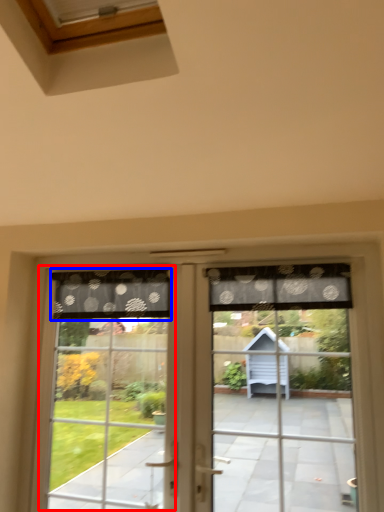
Question: Which of the following is the closest to the observer, bay window (highlighted by a red box) or curtain (highlighted by a blue box)?

Choices:
 (A) bay window
 (B) curtain

Answer: (A)